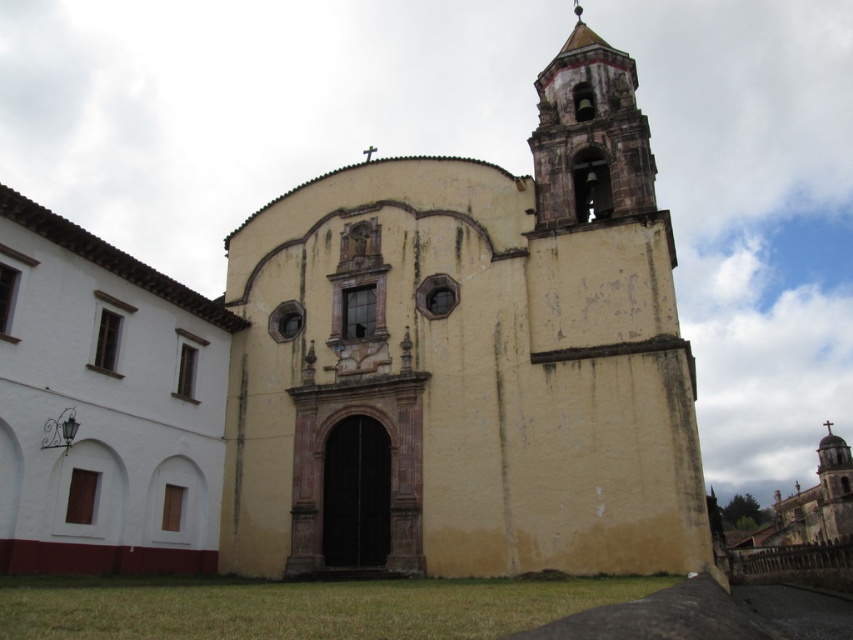
Question: Among these points, which one is nearest to the camera?

Choices:
 (A) (614, 97)
 (B) (105, 476)

Answer: (B)

Question: Is yellow matte church at center smaller than white matte building at left?

Choices:
 (A) yes
 (B) no

Answer: (B)

Question: Is yellow matte church at center below white matte building at left?

Choices:
 (A) yes
 (B) no

Answer: (B)

Question: Does yellow matte church at center have a greater width compared to white matte building at left?

Choices:
 (A) no
 (B) yes

Answer: (B)